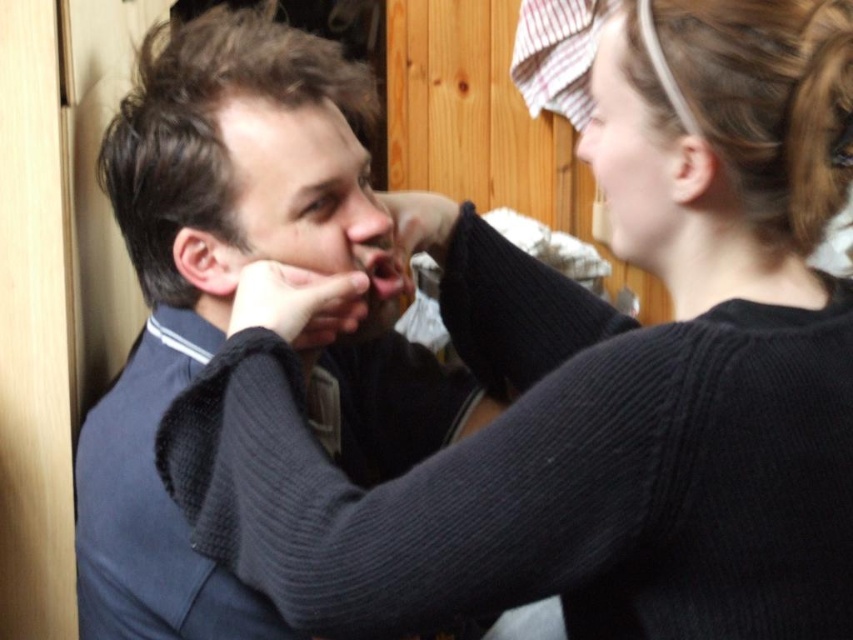
Question: Estimate the real-world distances between objects in this image. Which object is closer to the smooth skin face at center?

Choices:
 (A) smooth skin nose at center
 (B) matte black hair at upper right
 (C) matte skin nose at upper center
 (D) black knitted hand at center

Answer: (D)

Question: Does smooth skin face at center appear under matte skin nose at upper center?

Choices:
 (A) yes
 (B) no

Answer: (A)

Question: Which point is farther to the camera?

Choices:
 (A) smooth skin nose at center
 (B) matte black hair at upper right
 (C) black knitted hand at center

Answer: (A)

Question: Which object appears closest to the camera in this image?

Choices:
 (A) matte black hair at upper right
 (B) smooth skin face at center

Answer: (A)

Question: Can you confirm if smooth skin face at center is positioned above matte skin nose at upper center?

Choices:
 (A) no
 (B) yes

Answer: (A)

Question: Is smooth skin face at center bigger than matte black hair at upper right?

Choices:
 (A) no
 (B) yes

Answer: (B)